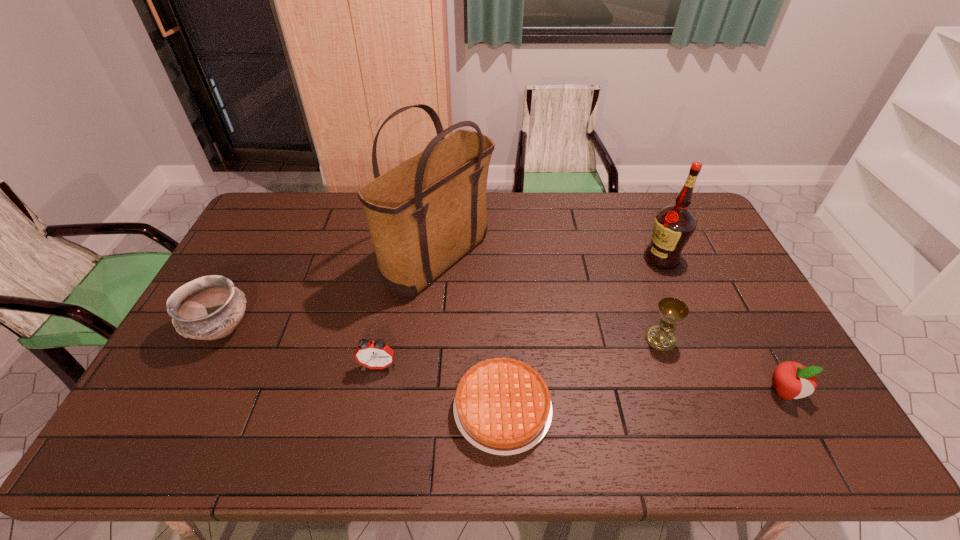
You are a GUI agent. You are given a task and a screenshot of the screen. Output one action in this format:
    pyautogui.click(x=<x>, y=<y>)
    Task: Click on the vacant space located on the label of the alcohol
    The width and height of the screenshot is (960, 540).
    Given the screenshot: What is the action you would take?
    pyautogui.click(x=587, y=259)

Locate an element on the screen. The width and height of the screenshot is (960, 540). vacant space located on the right of the leftmost object is located at coordinates (359, 329).

Identify the location of free space located on the front of the chalice. This screenshot has height=540, width=960. (690, 423).

You are a GUI agent. You are given a task and a screenshot of the screen. Output one action in this format:
    pyautogui.click(x=<x>, y=<y>)
    Task: Click on the free space located on the clock face of the alarm clock
    
    Given the screenshot: What is the action you would take?
    pyautogui.click(x=366, y=430)

Locate an element on the screen. vacant position located on the back of the rightmost object is located at coordinates (745, 320).

In order to click on free space located on the left of the shortest object in this screenshot , I will do `click(348, 409)`.

Identify the location of object that is at the far edge. (423, 215).

You are a GUI agent. You are given a task and a screenshot of the screen. Output one action in this format:
    pyautogui.click(x=<x>, y=<y>)
    Task: Click on the object located in the near edge section of the desktop
    This screenshot has width=960, height=540.
    Given the screenshot: What is the action you would take?
    coord(502,406)

Identify the location of object at the left edge. The image size is (960, 540). (208, 308).

Identify the location of object located at the right edge. The height and width of the screenshot is (540, 960). (791, 380).